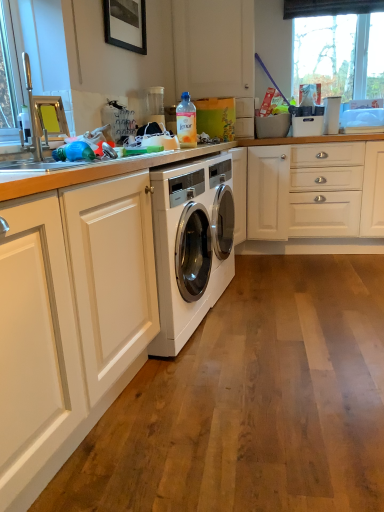
Question: Based on their sizes in the image, would you say transparent glass window at upper right is bigger or smaller than translucent plastic bottle at upper center?

Choices:
 (A) small
 (B) big

Answer: (B)

Question: Based on their positions, is transparent glass window at upper right located to the left or right of translucent plastic bottle at upper center?

Choices:
 (A) left
 (B) right

Answer: (B)

Question: Which object is the closest to the brushed metal sink at left?

Choices:
 (A) translucent plastic bottle at upper center
 (B) transparent glass window at upper right
 (C) black matte picture frame at upper center
 (D) white glossy washing machine at center

Answer: (A)

Question: Which object is positioned closest to the brushed metal sink at left?

Choices:
 (A) white glossy washing machine at center
 (B) black matte picture frame at upper center
 (C) translucent plastic bottle at upper center
 (D) transparent glass window at upper right

Answer: (C)